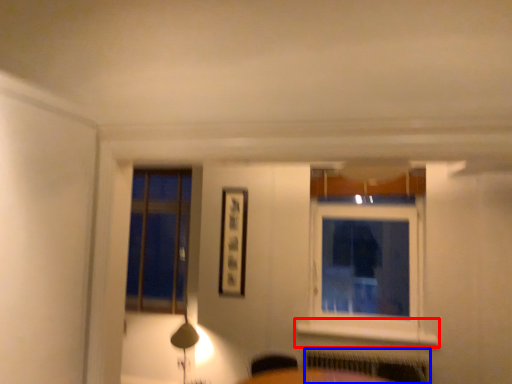
Question: Which object appears closest to the camera in this image, window sill (highlighted by a red box) or radiator (highlighted by a blue box)?

Choices:
 (A) window sill
 (B) radiator

Answer: (B)